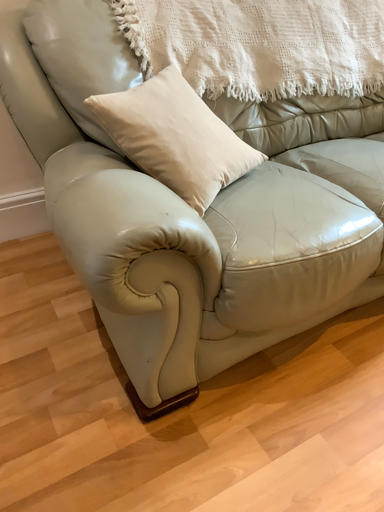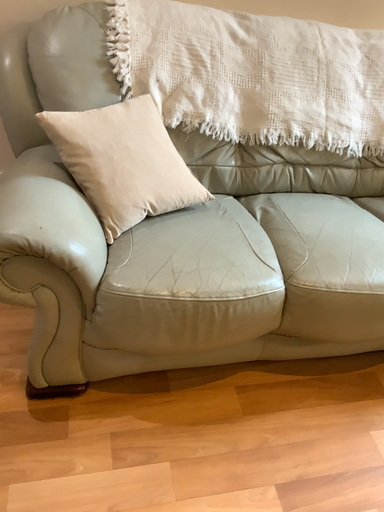
Question: How did the camera likely rotate when shooting the video?

Choices:
 (A) rotated left
 (B) rotated right

Answer: (A)